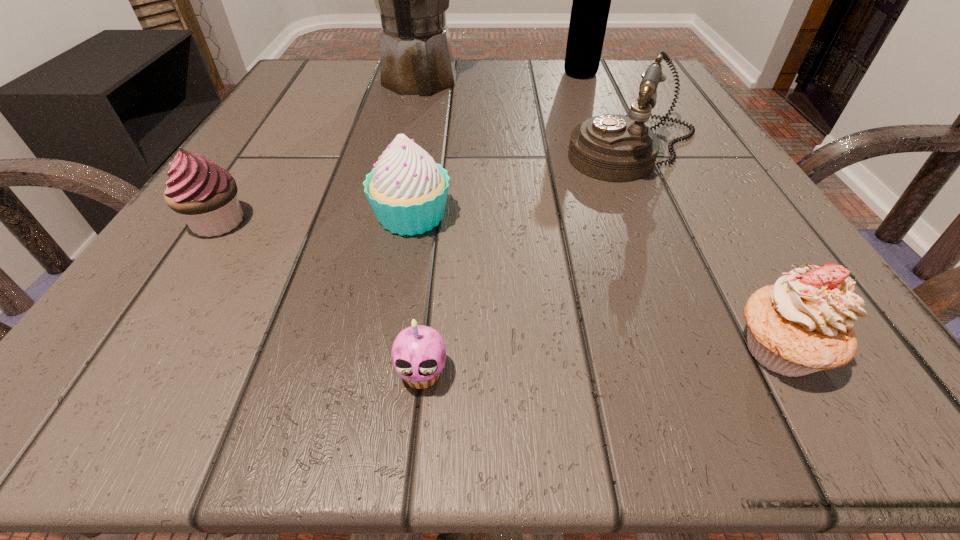
At what (x,y) coordinates should I click in order to perform the action: click on free space that is in between the leftmost object and the rightmost cupcake. Please return your answer as a coordinate pair (x, y). This screenshot has width=960, height=540. Looking at the image, I should click on (498, 286).

Select which object appears as the fifth closest to the shortest object. Please provide its 2D coordinates. Your answer should be formatted as a tuple, i.e. [(x, y)], where the tuple contains the x and y coordinates of a point satisfying the conditions above.

[(416, 56)]

This screenshot has height=540, width=960. I want to click on the sixth closest object to the fifth nearest object, so click(x=205, y=194).

Identify which cupcake is located as the third nearest to the coffeepot. Please provide its 2D coordinates. Your answer should be formatted as a tuple, i.e. [(x, y)], where the tuple contains the x and y coordinates of a point satisfying the conditions above.

[(418, 353)]

Identify which cupcake is the closest to the rightmost cupcake. Please provide its 2D coordinates. Your answer should be formatted as a tuple, i.e. [(x, y)], where the tuple contains the x and y coordinates of a point satisfying the conditions above.

[(418, 353)]

The image size is (960, 540). What are the coordinates of `free spot that satisfies the following two spatial constraints: 1. on the pouring side of the coffeepot; 2. on the left side of the beer bottle` in the screenshot? It's located at (420, 74).

This screenshot has height=540, width=960. Find the location of `vacant region that satisfies the following two spatial constraints: 1. on the front side of the rightmost cupcake; 2. on the right side of the telephone`. vacant region that satisfies the following two spatial constraints: 1. on the front side of the rightmost cupcake; 2. on the right side of the telephone is located at coordinates (731, 349).

Locate an element on the screen. The image size is (960, 540). vacant space that satisfies the following two spatial constraints: 1. on the pouring side of the coffeepot; 2. on the right side of the beer bottle is located at coordinates (420, 74).

The height and width of the screenshot is (540, 960). I want to click on free space that satisfies the following two spatial constraints: 1. on the pouring side of the beer bottle; 2. on the right side of the coffeepot, so click(420, 74).